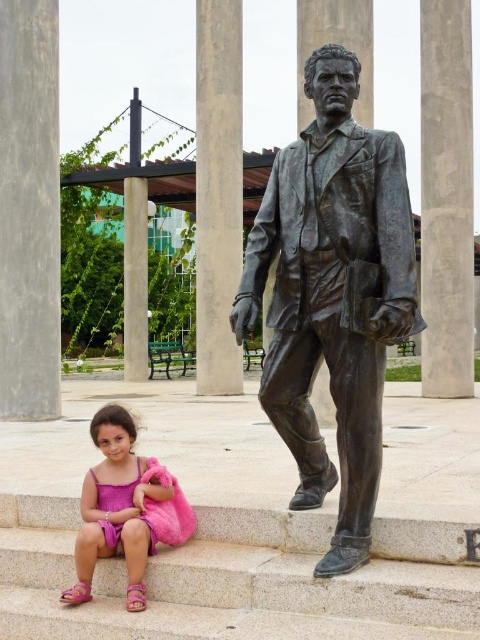
Question: Estimate the real-world distances between objects in this image. Which object is farther from the bronze pillar at center?

Choices:
 (A) smooth concrete pillar at right
 (B) gray concrete pillar at left
 (C) smooth concrete pillar at center
 (D) pink fabric at lower left

Answer: (D)

Question: Does white stone stairs at lower left have a lesser width compared to smooth concrete pillar at right?

Choices:
 (A) no
 (B) yes

Answer: (B)

Question: Which point is farther to the camera?

Choices:
 (A) (325, 563)
 (B) (427, 118)
 (C) (47, 170)
 (D) (153, 612)

Answer: (B)

Question: Which object is positioned farthest from the smooth concrete pillar at right?

Choices:
 (A) gray concrete pillar at left
 (B) bronze statue at center
 (C) white stone stairs at lower left
 (D) pink fabric at lower left

Answer: (C)

Question: Observing the image, what is the correct spatial positioning of bronze statue at center in reference to smooth concrete pillar at right?

Choices:
 (A) right
 (B) left

Answer: (B)

Question: Is white stone stairs at lower left positioned behind pink fabric at lower left?

Choices:
 (A) yes
 (B) no

Answer: (A)